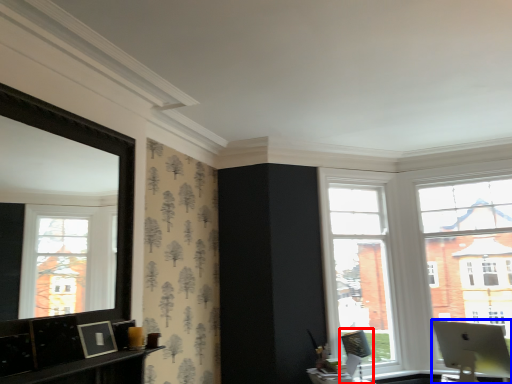
Question: Which object appears farthest to the camera in this image, swivel chair (highlighted by a red box) or laptop (highlighted by a blue box)?

Choices:
 (A) swivel chair
 (B) laptop

Answer: (A)